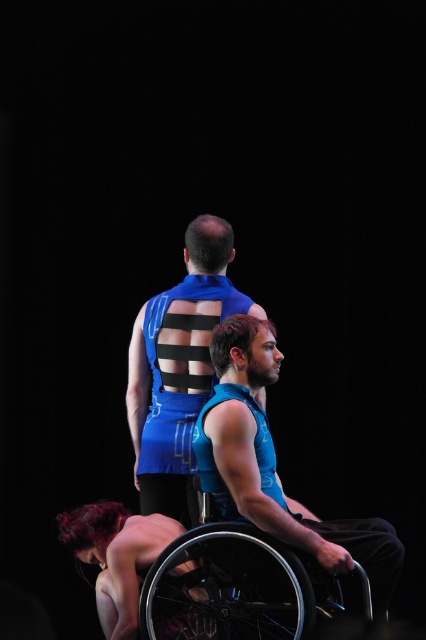
Based on the photo, you are a stagehand preparing to move a 16 inch wide prop from the blue matte vest at center to the smooth skin nude woman at lower left. Will the prop fit through the space between them without needing to move either object?

The distance between the blue matte vest at center and the smooth skin nude woman at lower left is 18.99 inches, which is wider than the 16 inch wide prop. Therefore, the prop can be moved through the space between them without needing to move either object.

You are an event planner setting up a stage for a performance. You need to ensure that the blue matte vest at center and the black metallic wheelchair at lower right are visible to the audience. Considering their sizes, which object might require more space to be clearly seen from the back of the venue?

The blue matte vest at center has a larger size compared to the black metallic wheelchair at lower right, so it might require more space to be clearly seen from the back of the venue.

You are a stage designer who needs to adjust the lighting for the performance. The blue matte vest at center and the smooth skin nude woman at lower left are both important focal points. Which object should you focus the spotlight on first if you want to highlight the one that is more to the right?

The blue matte vest at center is positioned on the right side of smooth skin nude woman at lower left, so you should first focus the spotlight on the blue matte vest at center since it is more to the right.